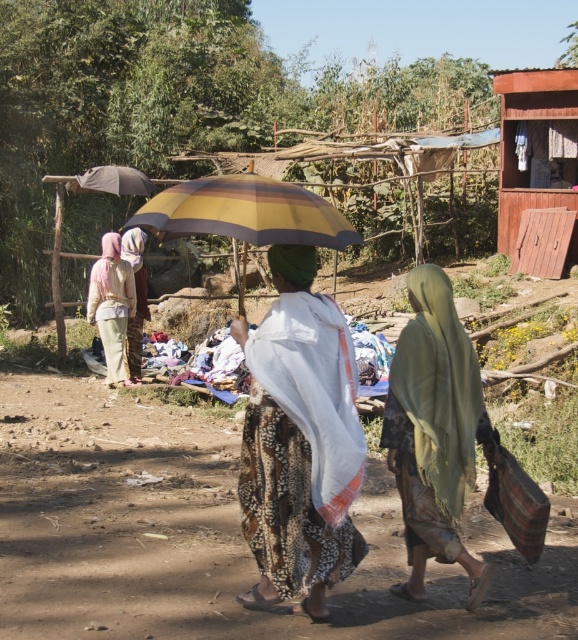
You are a photographer trying to capture both the patterned fabric dress at center and the yellow striped fabric umbrella at center in a single frame. Which object should you focus on first to ensure both are in the frame?

The patterned fabric dress at center is smaller than the yellow striped fabric umbrella at center, so you should focus on the yellow striped fabric umbrella at center first to ensure both are in the frame.

You are standing in the rural village scene depicted. There is a point marked at coordinates point (320, 604). If you want to reach this point without moving closer than 5 meters to the viewer, can you safely walk towards it?

The point (320, 604) is 4.63 meters from the viewer, which is less than 5 meters. Therefore, walking towards it would bring you closer than the 5 meter minimum distance required.

You are standing at the origin point in the image. You see two points marked as point 1 at coordinates point (513, 259) and point 2 at coordinates point (128, 291). Which point is closer to you?

Point 2 at coordinates point (128, 291) is closer to you because it is in front of point 1 at coordinates point (513, 259).